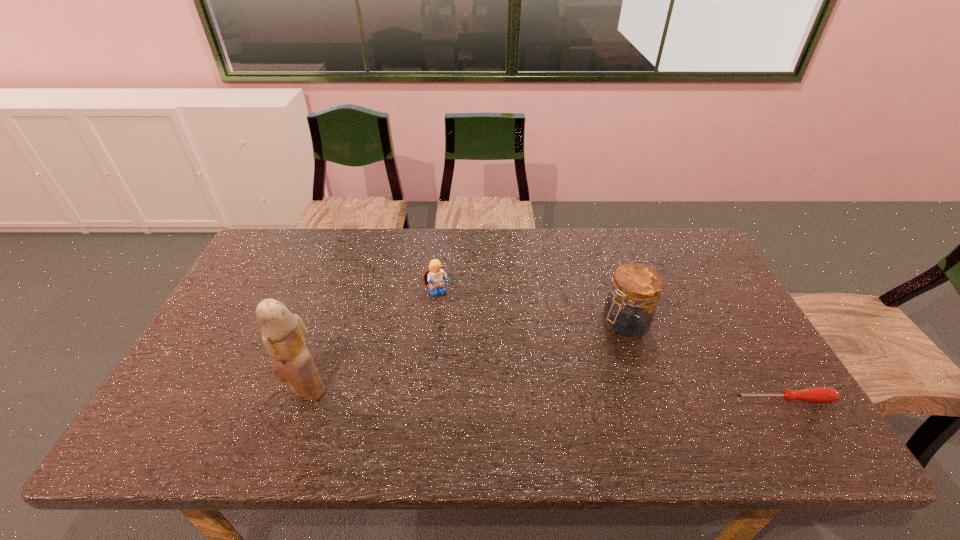
Locate an element on the screen. The height and width of the screenshot is (540, 960). blank space located on the front-facing side of the tallest object is located at coordinates (216, 389).

This screenshot has height=540, width=960. Identify the location of free space located on the lid of the third object from left to right. (533, 385).

Where is `free region located 0.210m on the lid of the third object from left to right`? This screenshot has width=960, height=540. free region located 0.210m on the lid of the third object from left to right is located at coordinates (551, 373).

Where is `vacant space located 0.230m on the lid of the third object from left to right`? vacant space located 0.230m on the lid of the third object from left to right is located at coordinates (544, 377).

In order to click on vacant region located on the front-facing side of the farthest object in this screenshot , I will do `click(501, 392)`.

Find the location of `vacant space located 0.250m on the front-facing side of the farthest object`. vacant space located 0.250m on the front-facing side of the farthest object is located at coordinates (482, 362).

Where is `vacant region located on the front-facing side of the farthest object`? The height and width of the screenshot is (540, 960). vacant region located on the front-facing side of the farthest object is located at coordinates (497, 386).

Locate an element on the screen. figurine positioned at the near edge is located at coordinates (283, 333).

Where is `screwdriver at the near edge`? Image resolution: width=960 pixels, height=540 pixels. screwdriver at the near edge is located at coordinates (816, 394).

Locate an element on the screen. Image resolution: width=960 pixels, height=540 pixels. object that is at the right edge is located at coordinates (816, 394).